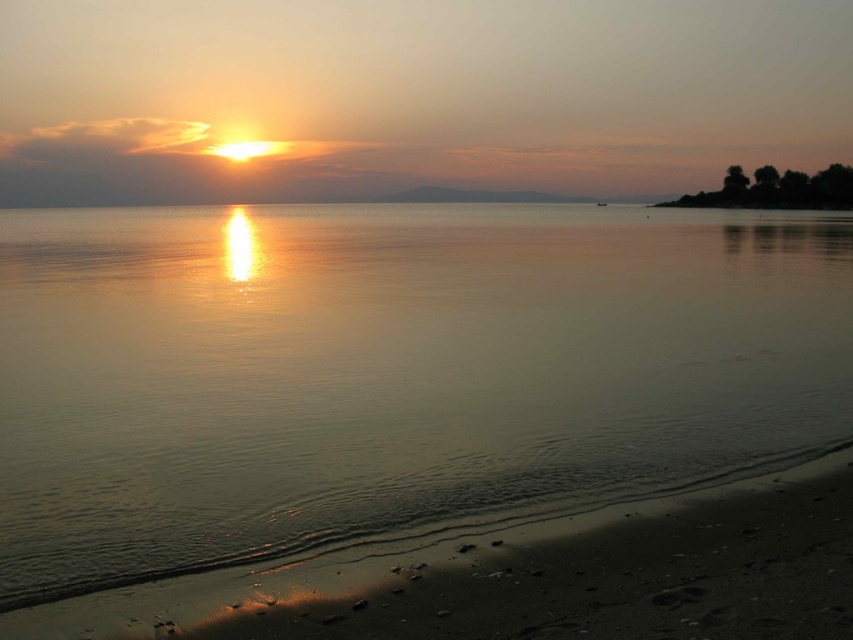
Which is behind, point (204, 385) or point (482, 566)?

Positioned behind is point (204, 385).

Is smooth water at center to the right of sandy beach at lower right from the viewer's perspective?

Indeed, smooth water at center is positioned on the right side of sandy beach at lower right.

This screenshot has height=640, width=853. Describe the element at coordinates (389, 372) in the screenshot. I see `smooth water at center` at that location.

Identify the location of smooth water at center. (389, 372).